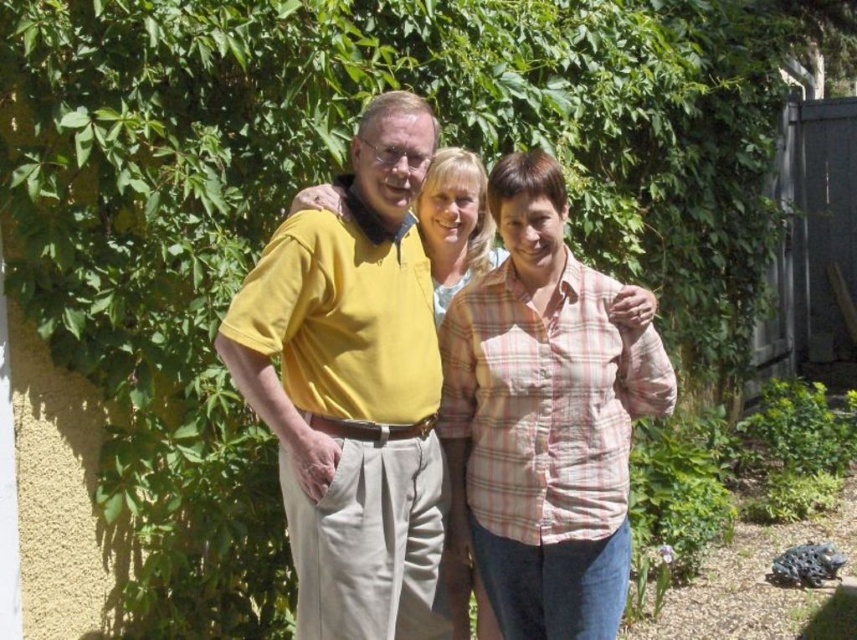
Question: Which object appears farthest from the camera in this image?

Choices:
 (A) pink plaid shirt at center
 (B) yellow cotton shirt at center

Answer: (A)

Question: Does yellow cotton shirt at center have a smaller size compared to pink plaid shirt at center?

Choices:
 (A) no
 (B) yes

Answer: (A)

Question: Among these objects, which one is nearest to the camera?

Choices:
 (A) pink plaid shirt at center
 (B) yellow cotton shirt at center

Answer: (B)

Question: Does yellow cotton shirt at center lie behind pink plaid shirt at center?

Choices:
 (A) no
 (B) yes

Answer: (A)

Question: Is yellow cotton shirt at center above pink plaid shirt at center?

Choices:
 (A) yes
 (B) no

Answer: (A)